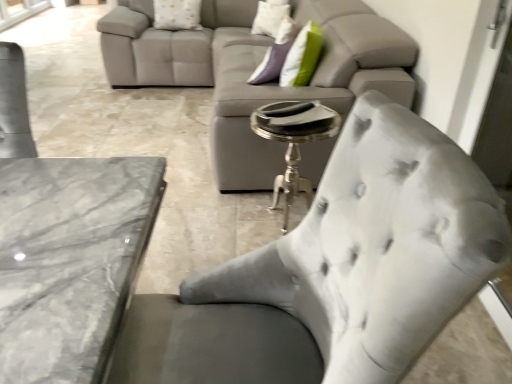
Where is `free point to the left of silver metallic side table at center`? free point to the left of silver metallic side table at center is located at coordinates (207, 223).